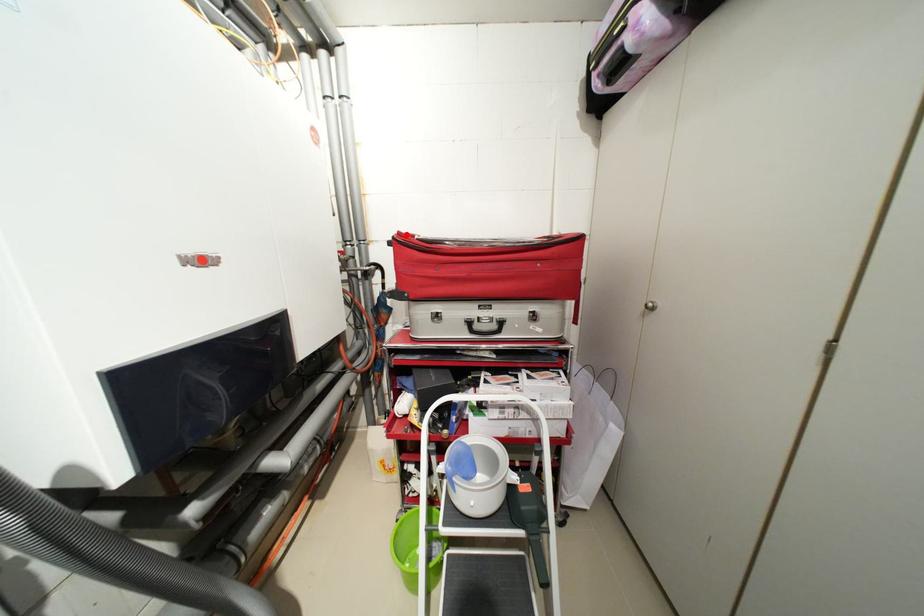
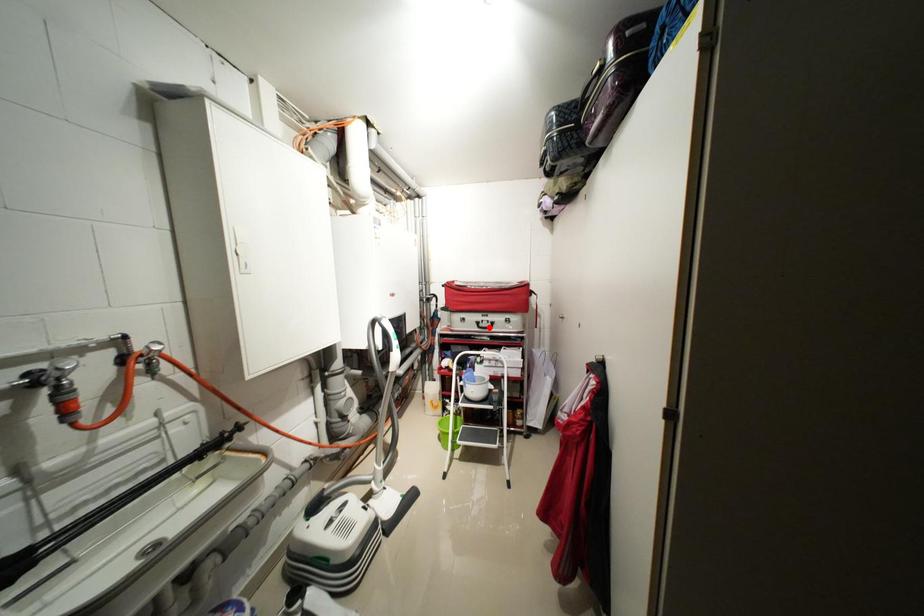
I am providing you with two images of the same scene from different viewpoints. A red point is marked on the first image and another point is marked on the second image. Does the point marked in image1 correspond to the same location as the one in image2?

No